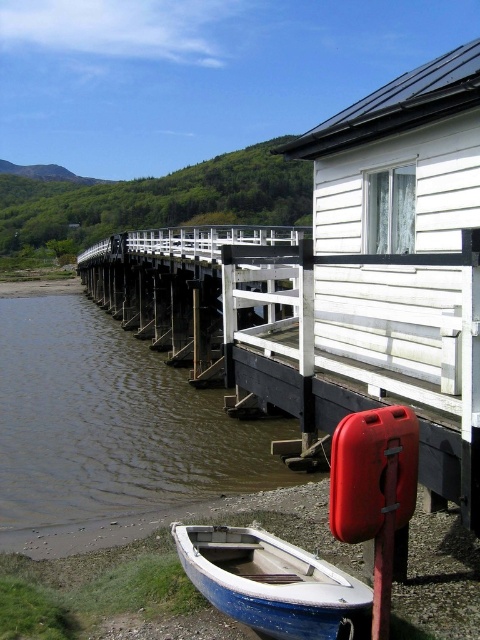
You are a maintenance worker needing to reach the white wooden rail at center from your current position at the brown murky water at lower left. Can you safely walk directly to it given the distance is 8.76 meters?

The brown murky water at lower left is 8.76 meters away from the white wooden rail at center. Since the distance is over 8 meters, it might be challenging to walk directly without a clear path, but the exact safety depends on the terrain between them which isn

You are standing on the wooden pier and want to retrieve the red lifebuoy on the right side of the small white building. To avoid stepping into the brown murky water at lower left, which direction should you move relative to the white wooden rail at center?

To avoid stepping into the brown murky water at lower left, you should move to the right of the white wooden rail at center since the brown murky water is located to the left of it.

You are standing on the wooden pier and want to place a small potted plant between the brown murky water at lower left and the blue painted wood boat at lower left. Where should you place the plant to ensure it stays between them?

The brown murky water at lower left is positioned on the left side of blue painted wood boat at lower left, so you should place the plant between them by positioning it to the right of the brown murky water at lower left and to the left of the blue painted wood boat at lower left.